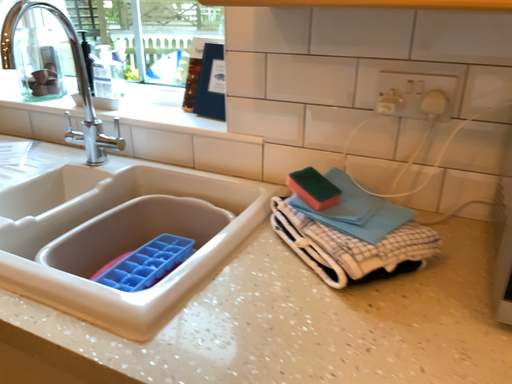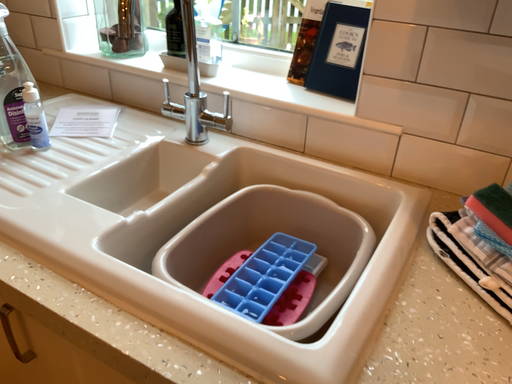
Question: Which way did the camera rotate in the video?

Choices:
 (A) rotated upward
 (B) rotated downward

Answer: (B)